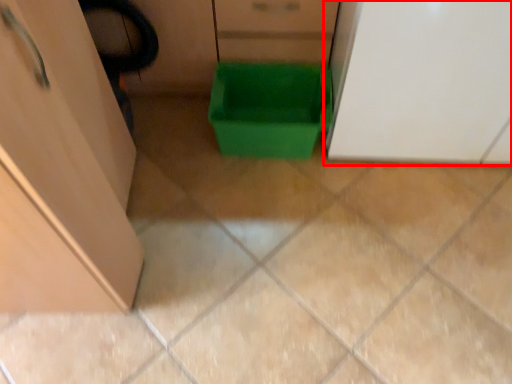
Question: Where is cabinetry (annotated by the red box) located in relation to storage box in the image?

Choices:
 (A) left
 (B) right

Answer: (B)